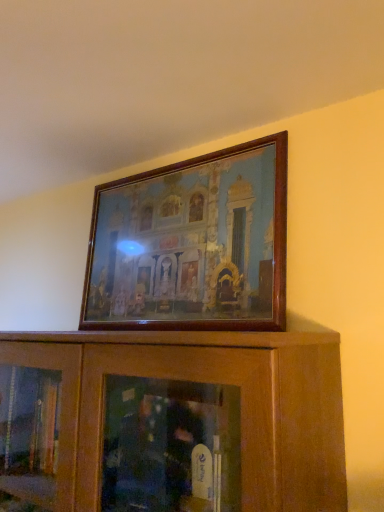
Where is `wooden picture frame at upper center`? The image size is (384, 512). wooden picture frame at upper center is located at coordinates (192, 244).

This screenshot has height=512, width=384. What do you see at coordinates (192, 244) in the screenshot?
I see `wooden picture frame at upper center` at bounding box center [192, 244].

At what (x,y) coordinates should I click in order to perform the action: click on wooden picture frame at upper center. Please return your answer as a coordinate pair (x, y). Image resolution: width=384 pixels, height=512 pixels. Looking at the image, I should click on (192, 244).